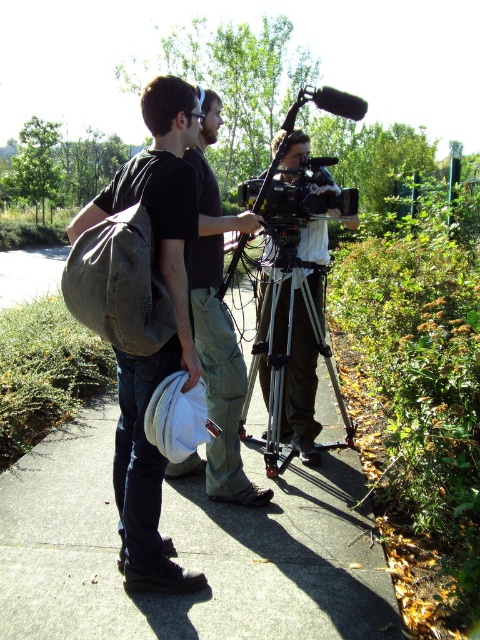
You are standing on the concrete at center. There is a person with a beige backpack on the left and another person to their right. Which direction should you face to look at the person with the beige backpack?

You should face to the left to look at the person with the beige backpack because the person with the beige backpack is positioned to the left of the concrete at center.

You are standing in the park and want to place a small plant pot between the concrete at center and the silver metallic tripod at center. Which object should the pot be closer to if you want it to appear larger in the photo?

The concrete at center is closer to the viewer than the silver metallic tripod at center. To make the plant pot appear larger in the photo, place it closer to the concrete at center since objects closer to the camera appear larger.

Consider the image. You are standing at the point labeled point (x=188, y=109) and want to walk to the point labeled point (x=245, y=572). Is the point you want to reach in front of or behind you?

The point labeled point (x=245, y=572) is behind the point labeled point (x=188, y=109), so it is behind you.